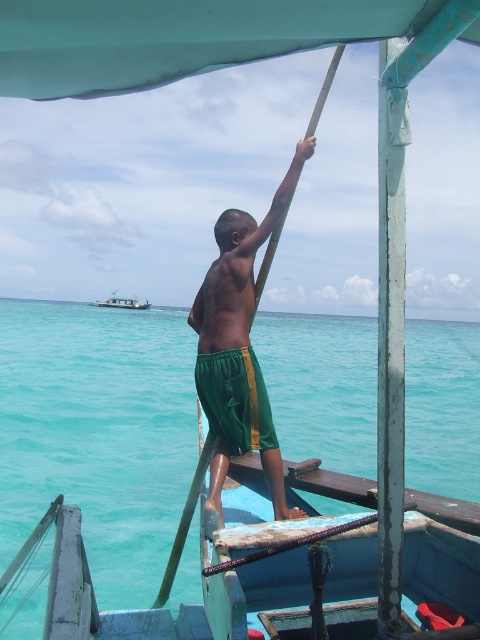
Where is `teal fabric canopy at upper center`? This screenshot has height=640, width=480. teal fabric canopy at upper center is located at coordinates (175, 36).

Does teal fabric canopy at upper center appear under teal painted wood pole at right?

Yes, teal fabric canopy at upper center is below teal painted wood pole at right.

Is point (274, 26) closer to camera compared to point (392, 429)?

Yes, it is.

At what (x,y) coordinates should I click in order to perform the action: click on teal fabric canopy at upper center. Please return your answer as a coordinate pair (x, y). Looking at the image, I should click on (175, 36).

Between green fabric shorts at center and white plastic boat at upper left, which one has less height?

white plastic boat at upper left

Does green fabric shorts at center appear over white plastic boat at upper left?

No, green fabric shorts at center is not above white plastic boat at upper left.

What do you see at coordinates (238, 269) in the screenshot? I see `green fabric shorts at center` at bounding box center [238, 269].

This screenshot has width=480, height=640. What are the coordinates of `green fabric shorts at center` in the screenshot? It's located at pos(238,269).

What do you see at coordinates (391, 339) in the screenshot?
I see `teal painted wood pole at right` at bounding box center [391, 339].

In the scene shown: How far apart are teal painted wood pole at right and green fabric shorts at center?

teal painted wood pole at right is 3.91 feet away from green fabric shorts at center.

The width and height of the screenshot is (480, 640). What do you see at coordinates (391, 339) in the screenshot?
I see `teal painted wood pole at right` at bounding box center [391, 339].

At what (x,y) coordinates should I click in order to perform the action: click on teal painted wood pole at right. Please return your answer as a coordinate pair (x, y). This screenshot has width=480, height=640. Looking at the image, I should click on (391, 339).